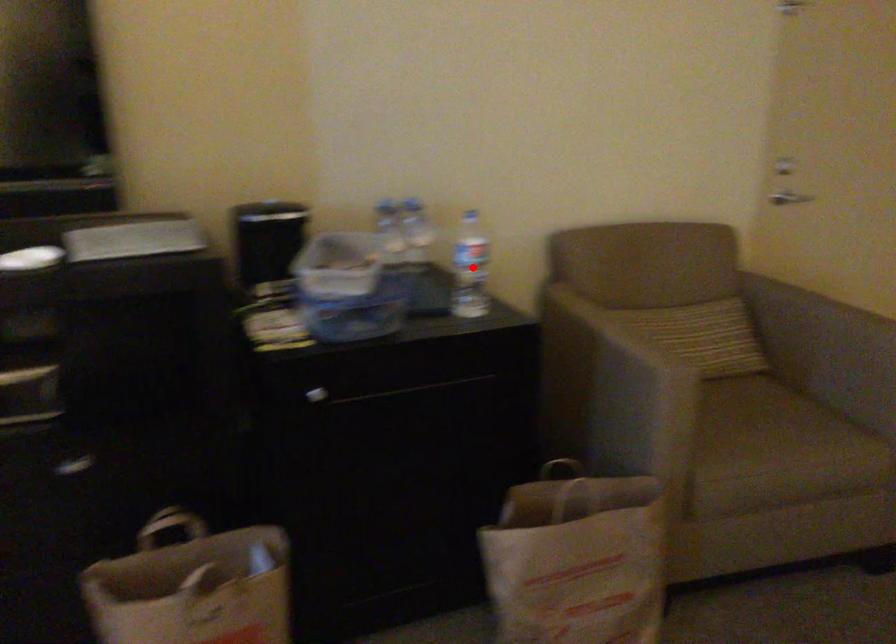
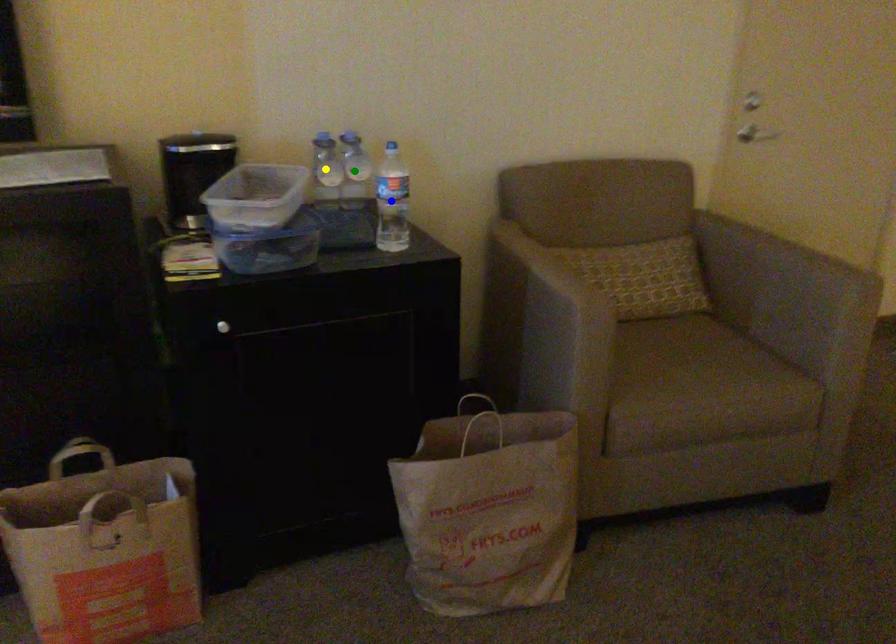
Question: I am providing you with two images of the same scene from different viewpoints. A red point is marked on the first image. You are given multiple points on the second image. Can you choose the point in image 2 that corresponds to the point in image 1?

Choices:
 (A) green point
 (B) yellow point
 (C) blue point

Answer: (C)